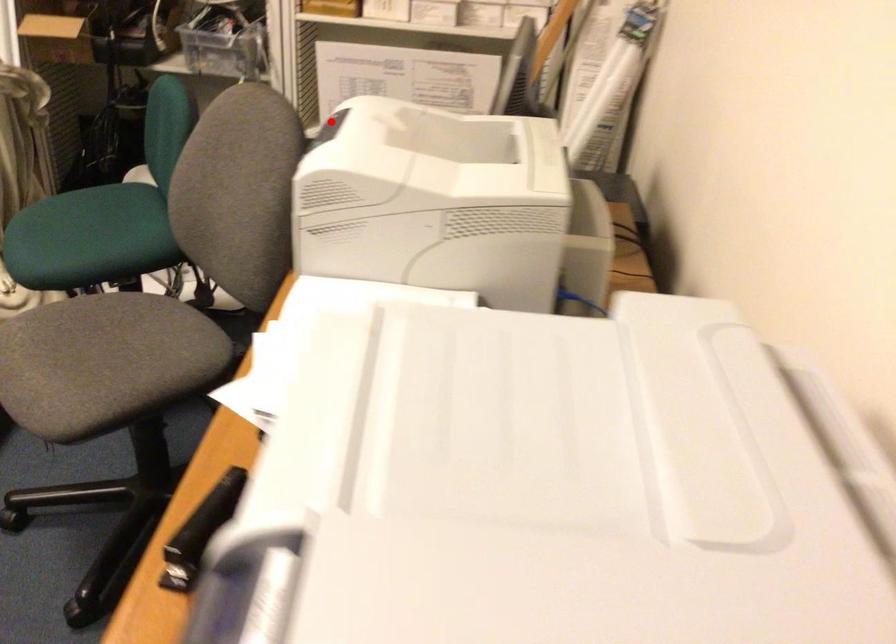
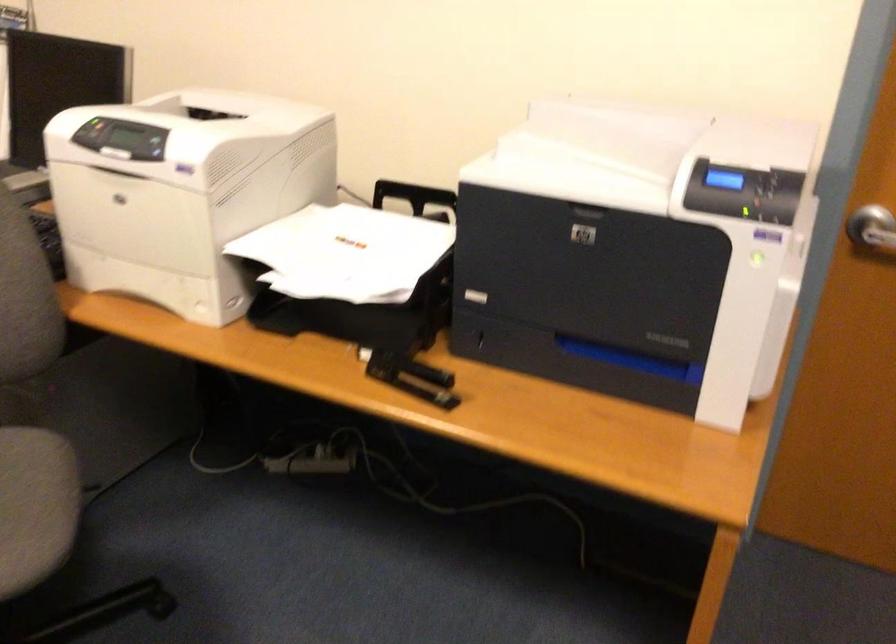
In the second image, find the point that corresponds to the highlighted location in the first image.

(91, 131)